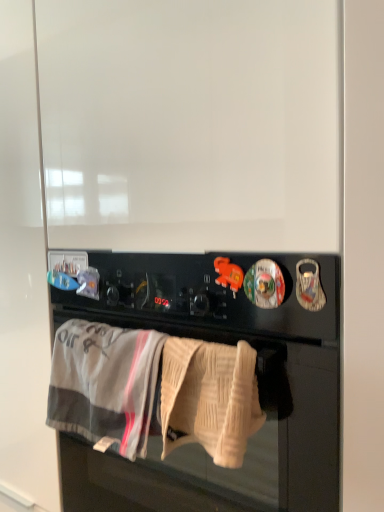
Question: In terms of width, does black matte oven at center look wider or thinner when compared to beige knitted towel at lower center, marked as the first bath towel in a right-to-left arrangement?

Choices:
 (A) thin
 (B) wide

Answer: (B)

Question: Is black matte oven at center taller or shorter than beige knitted towel at lower center, which is the 2th bath towel from left to right?

Choices:
 (A) tall
 (B) short

Answer: (A)

Question: Estimate the real-world distances between objects in this image. Which object is farther from the black matte oven at center?

Choices:
 (A) beige knitted towel at lower center, which is the 2th bath towel from left to right
 (B) gray cotton bath towel at lower center, positioned as the first bath towel in left-to-right order

Answer: (B)

Question: Which of these objects is positioned closest to the gray cotton bath towel at lower center, which is the 2th bath towel from right to left?

Choices:
 (A) black matte oven at center
 (B) beige knitted towel at lower center, marked as the first bath towel in a right-to-left arrangement

Answer: (B)